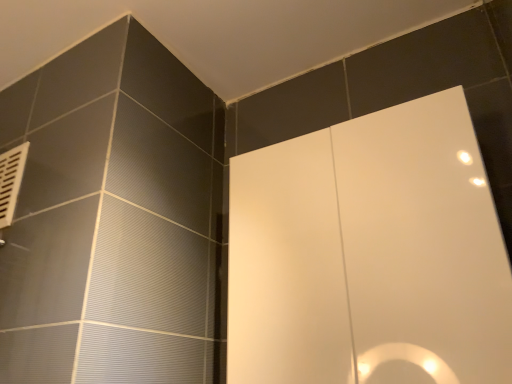
Question: Considering the relative positions of white plastic vent at upper left and white glossy screen door at center in the image provided, is white plastic vent at upper left to the right of white glossy screen door at center from the viewer's perspective?

Choices:
 (A) no
 (B) yes

Answer: (A)

Question: Does white plastic vent at upper left have a greater height compared to white glossy screen door at center?

Choices:
 (A) no
 (B) yes

Answer: (A)

Question: From a real-world perspective, does white plastic vent at upper left stand above white glossy screen door at center?

Choices:
 (A) no
 (B) yes

Answer: (B)

Question: Is white plastic vent at upper left not close to white glossy screen door at center?

Choices:
 (A) yes
 (B) no

Answer: (B)

Question: Does white plastic vent at upper left turn towards white glossy screen door at center?

Choices:
 (A) yes
 (B) no

Answer: (B)

Question: Is white glossy screen door at center at the back of white plastic vent at upper left?

Choices:
 (A) no
 (B) yes

Answer: (A)

Question: Is white glossy screen door at center closer to the viewer compared to white plastic vent at upper left?

Choices:
 (A) yes
 (B) no

Answer: (A)

Question: From a real-world perspective, is white glossy screen door at center positioned under white plastic vent at upper left based on gravity?

Choices:
 (A) yes
 (B) no

Answer: (A)

Question: Is the surface of white glossy screen door at center in direct contact with white plastic vent at upper left?

Choices:
 (A) no
 (B) yes

Answer: (A)

Question: From the image's perspective, is white glossy screen door at center over white plastic vent at upper left?

Choices:
 (A) yes
 (B) no

Answer: (B)

Question: Is there a large distance between white glossy screen door at center and white plastic vent at upper left?

Choices:
 (A) no
 (B) yes

Answer: (A)

Question: Is white glossy screen door at center shorter than white plastic vent at upper left?

Choices:
 (A) yes
 (B) no

Answer: (B)

Question: From the image's perspective, is white glossy screen door at center positioned above or below white plastic vent at upper left?

Choices:
 (A) above
 (B) below

Answer: (B)